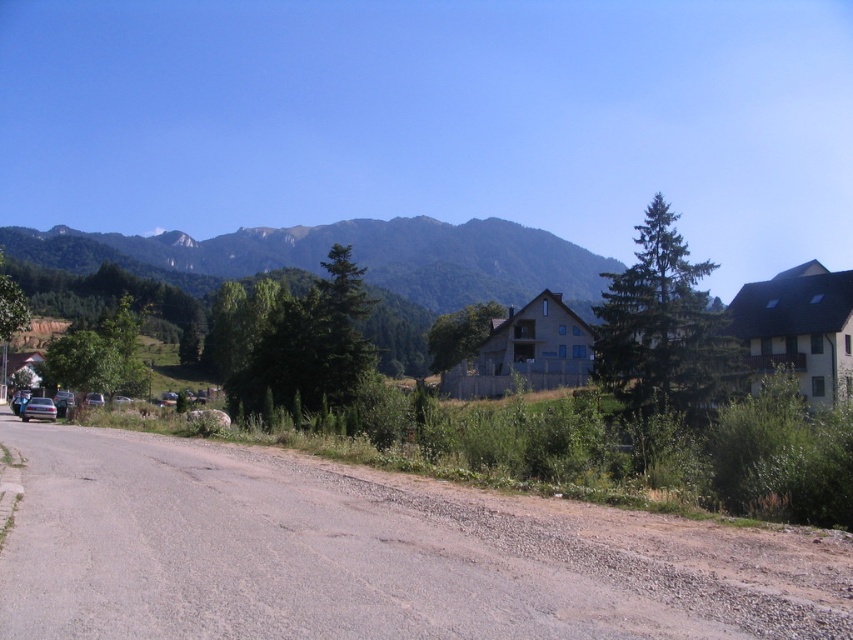
In the scene shown: Is dirt/gravel road at lower center to the right of blue metallic motorcycle at left from the viewer's perspective?

Correct, you'll find dirt/gravel road at lower center to the right of blue metallic motorcycle at left.

Is point (490, 556) positioned behind point (12, 406)?

No, (490, 556) is in front of (12, 406).

Describe the element at coordinates (367, 556) in the screenshot. The width and height of the screenshot is (853, 640). I see `dirt/gravel road at lower center` at that location.

You are a GUI agent. You are given a task and a screenshot of the screen. Output one action in this format:
    pyautogui.click(x=<x>, y=<y>)
    Task: Click on the dirt/gravel road at lower center
    The height and width of the screenshot is (640, 853).
    Given the screenshot: What is the action you would take?
    pyautogui.click(x=367, y=556)

Can you confirm if dirt/gravel road at lower center is wider than green forested mountain at upper center?

In fact, dirt/gravel road at lower center might be narrower than green forested mountain at upper center.

Is dirt/gravel road at lower center above green forested mountain at upper center?

Actually, dirt/gravel road at lower center is below green forested mountain at upper center.

Who is more forward, (x=403, y=618) or (x=477, y=268)?

Point (x=403, y=618) is in front.

Identify the location of dirt/gravel road at lower center. The image size is (853, 640). click(367, 556).

Between green forested mountain at upper center and blue metallic motorcycle at left, which one appears on the left side from the viewer's perspective?

blue metallic motorcycle at left

Which of these two, green forested mountain at upper center or blue metallic motorcycle at left, stands taller?

green forested mountain at upper center

Which is behind, point (70, 262) or point (15, 394)?

The point (70, 262) is more distant.

The height and width of the screenshot is (640, 853). I want to click on green forested mountain at upper center, so click(352, 257).